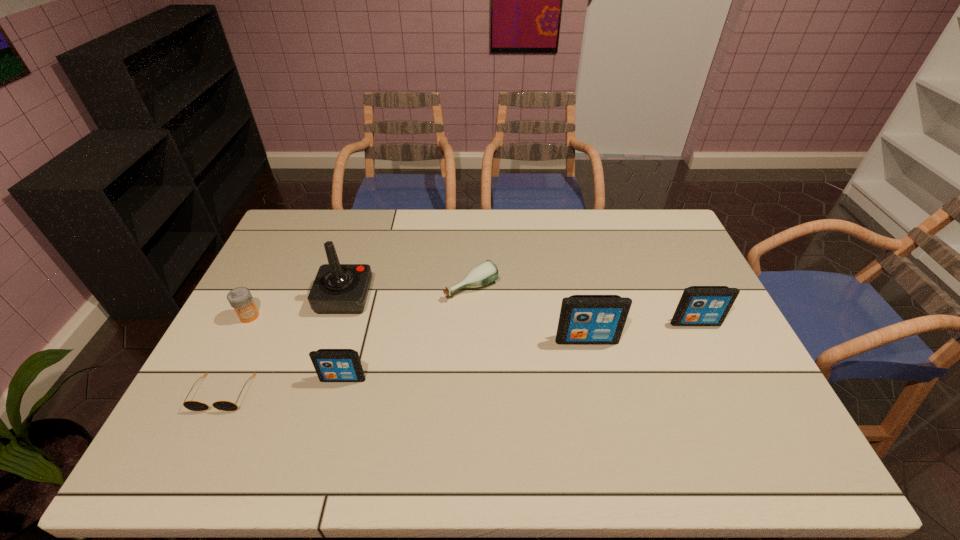
Where is `vacant region between the joystick and the tallest iPod`? This screenshot has height=540, width=960. vacant region between the joystick and the tallest iPod is located at coordinates (466, 319).

The image size is (960, 540). Find the location of `vacant area that lies between the third shortest object and the rightmost object`. vacant area that lies between the third shortest object and the rightmost object is located at coordinates (472, 320).

Locate an element on the screen. The height and width of the screenshot is (540, 960). unoccupied position between the rightmost object and the fourth shortest object is located at coordinates (519, 350).

The image size is (960, 540). Find the location of `unoccupied area between the shortest iPod and the shortest object`. unoccupied area between the shortest iPod and the shortest object is located at coordinates (283, 386).

Locate an element on the screen. The width and height of the screenshot is (960, 540). object that is the closest one to the medicine is located at coordinates (338, 288).

This screenshot has height=540, width=960. I want to click on the sixth closest object to the shortest object, so click(699, 305).

Locate which iPod ranks in proximity to the fifth shortest object. Please provide its 2D coordinates. Your answer should be formatted as a tuple, i.e. [(x, y)], where the tuple contains the x and y coordinates of a point satisfying the conditions above.

[(584, 319)]

Identify which iPod is the nearest to the second iPod from right to left. Please provide its 2D coordinates. Your answer should be formatted as a tuple, i.e. [(x, y)], where the tuple contains the x and y coordinates of a point satisfying the conditions above.

[(699, 305)]

Locate an element on the screen. The height and width of the screenshot is (540, 960). vacant area in the image that satisfies the following two spatial constraints: 1. on the front-facing side of the tallest object; 2. on the front-facing side of the shortest object is located at coordinates (315, 393).